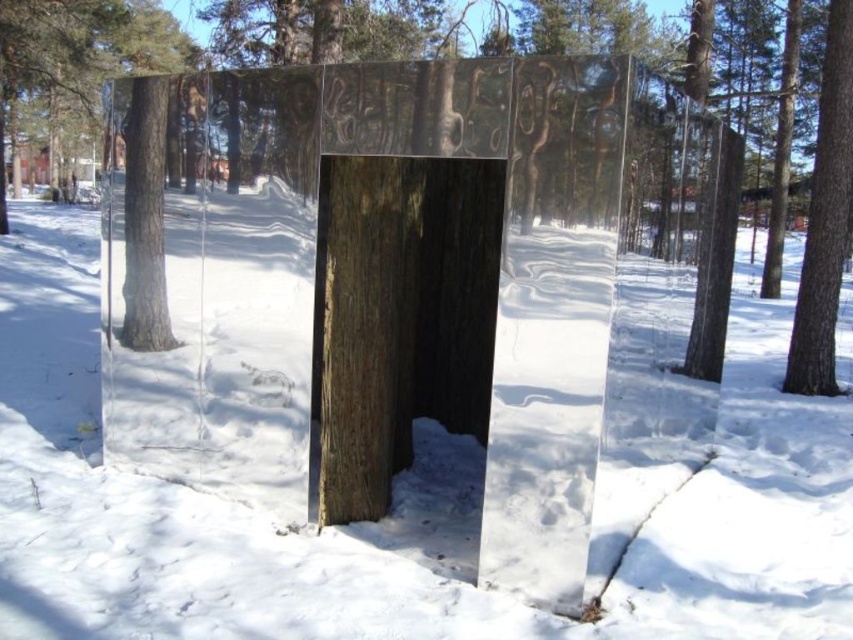
Looking at this image, who is positioned more to the left, white snow at center or smooth brown bark at right?

white snow at center is more to the left.

Which is in front, point (836, 406) or point (798, 364)?

Point (836, 406) is more forward.

Which is behind, point (792, 445) or point (798, 384)?

Point (798, 384)

Where is `white snow at center`? white snow at center is located at coordinates pos(384,520).

Is transparent wood at center above smooth brown bark at right?

Indeed, transparent wood at center is positioned over smooth brown bark at right.

Between point (102, 77) and point (839, 0), which one is positioned behind?

Point (102, 77)

You are a GUI agent. You are given a task and a screenshot of the screen. Output one action in this format:
    pyautogui.click(x=<x>, y=<y>)
    Task: Click on the transparent wood at center
    
    Given the screenshot: What is the action you would take?
    pyautogui.click(x=84, y=49)

How distant is white snow at center from brown rough wood at center?

5.04 feet

Who is lower down, white snow at center or brown rough wood at center?

white snow at center

The image size is (853, 640). Find the location of `white snow at center`. white snow at center is located at coordinates (384, 520).

At what (x,y) coordinates should I click in order to perform the action: click on white snow at center. Please return your answer as a coordinate pair (x, y). The width and height of the screenshot is (853, 640). Looking at the image, I should click on (384, 520).